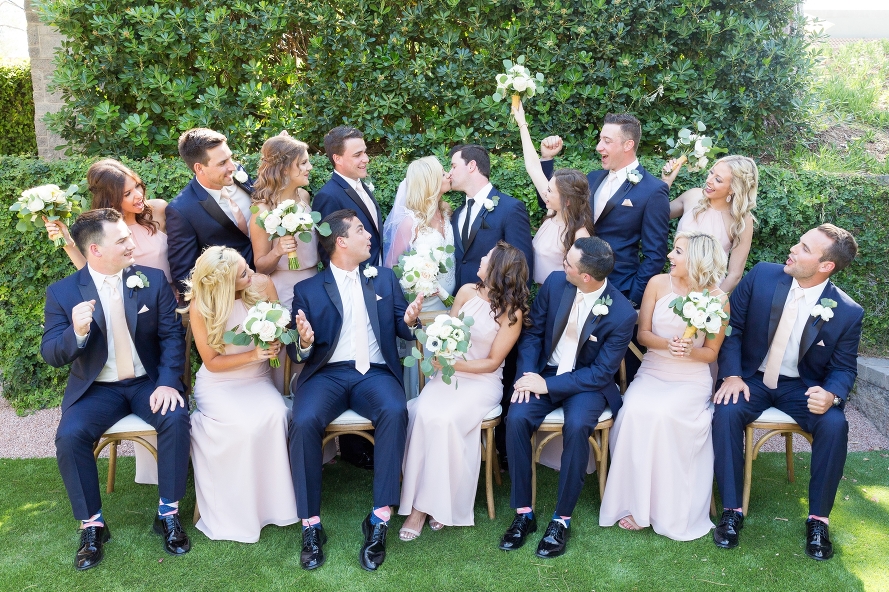
I want to click on seat cushion on chair, so click(771, 424), click(549, 419), click(497, 413), click(359, 413), click(135, 426).